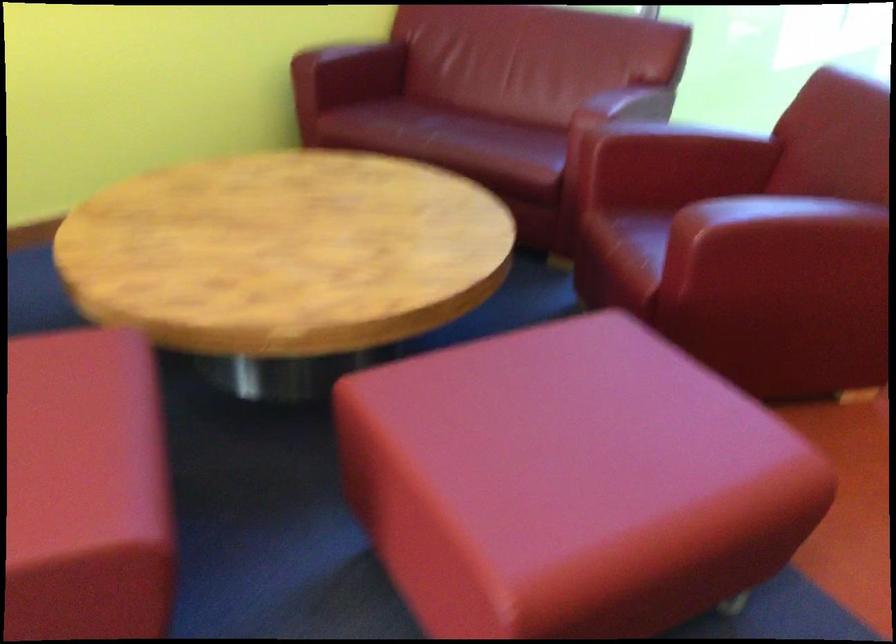
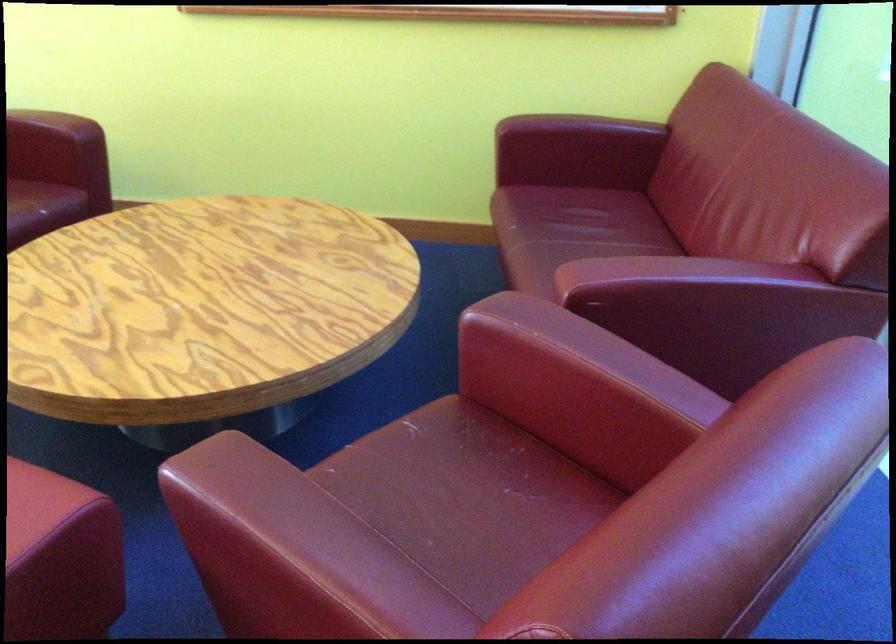
Find the pixel in the second image that matches point 417,104 in the first image.

(592, 210)